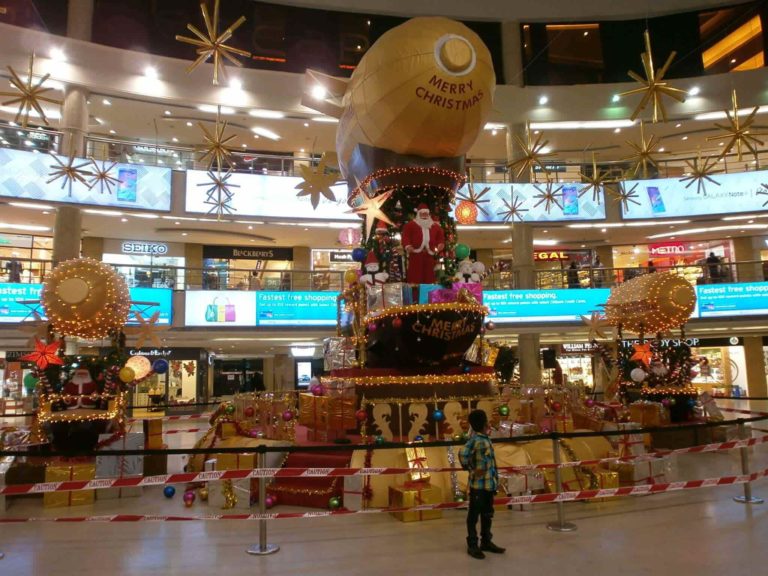
This screenshot has width=768, height=576. I want to click on christmas ornaments, so click(170, 488), click(194, 502), click(197, 492), click(233, 500), click(269, 501), click(332, 502).